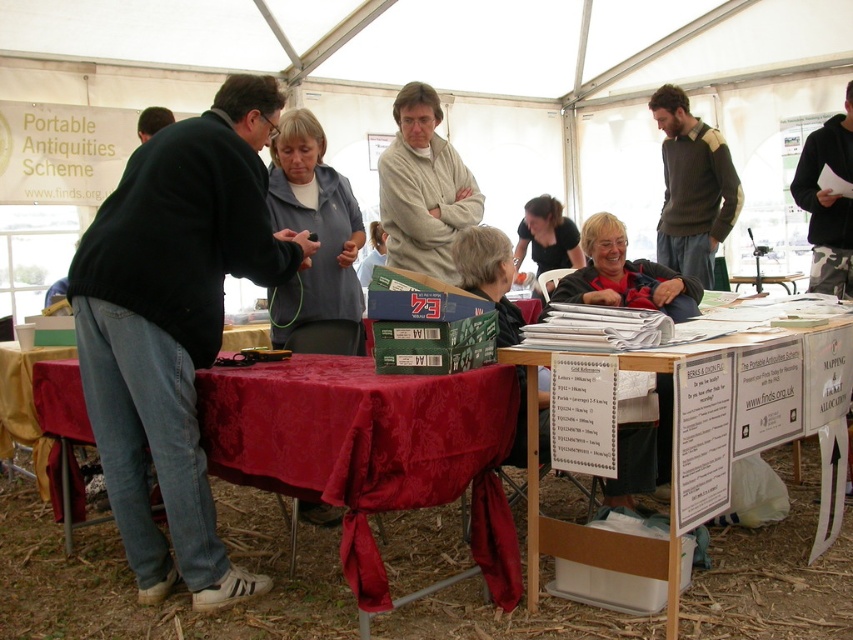
Between point (230, 208) and point (59, 368), which one is positioned in front?

Positioned in front is point (230, 208).

Can you confirm if black matte jacket at left is bigger than red satin tablecloth at lower left?

Actually, black matte jacket at left might be smaller than red satin tablecloth at lower left.

Between point (201, 349) and point (479, 400), which one is positioned behind?

Point (201, 349)

Where is `black matte jacket at left`? Image resolution: width=853 pixels, height=640 pixels. black matte jacket at left is located at coordinates (175, 324).

Does black matte jacket at left have a greater width compared to dark brown sweater at upper right?

Yes, black matte jacket at left is wider than dark brown sweater at upper right.

Does point (128, 241) lie behind point (709, 209)?

No, (128, 241) is in front of (709, 209).

The image size is (853, 640). I want to click on black matte jacket at left, so click(175, 324).

What do you see at coordinates (175, 324) in the screenshot? I see `black matte jacket at left` at bounding box center [175, 324].

Where is `black matte jacket at left`? The image size is (853, 640). black matte jacket at left is located at coordinates (175, 324).

Where is `black matte jacket at left`? This screenshot has height=640, width=853. black matte jacket at left is located at coordinates (175, 324).